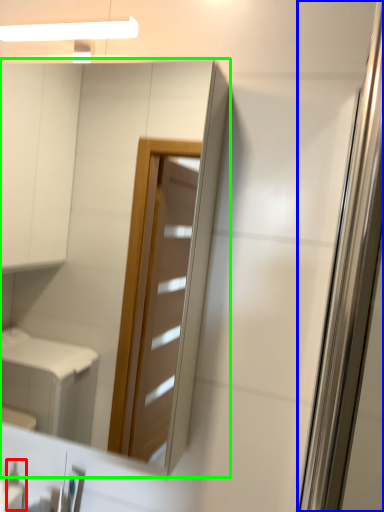
Question: Based on their relative distances, which object is nearer to toiletry (highlighted by a red box)? Choose from screen door (highlighted by a blue box) and mirror (highlighted by a green box).

Choices:
 (A) screen door
 (B) mirror

Answer: (A)